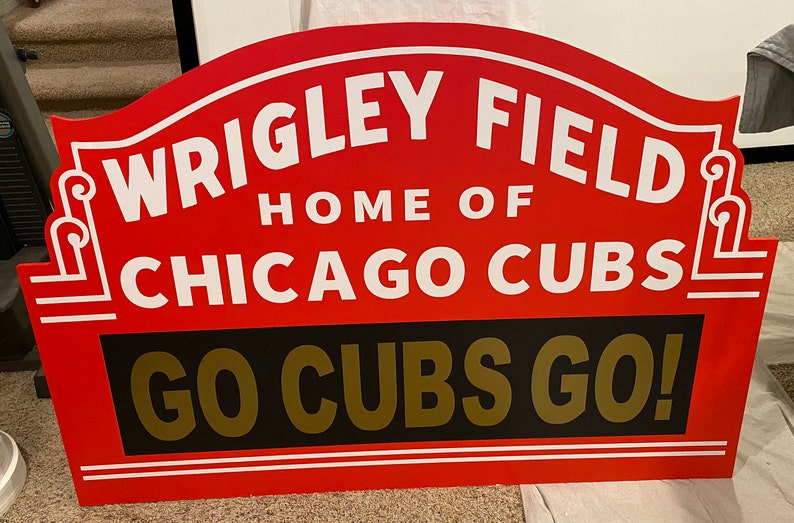
You are a GUI agent. You are given a task and a screenshot of the screen. Output one action in this format:
    pyautogui.click(x=<x>, y=<y>)
    Task: Click on the towel or rug
    The image size is (794, 523).
    Given the screenshot: What is the action you would take?
    pyautogui.click(x=769, y=82)